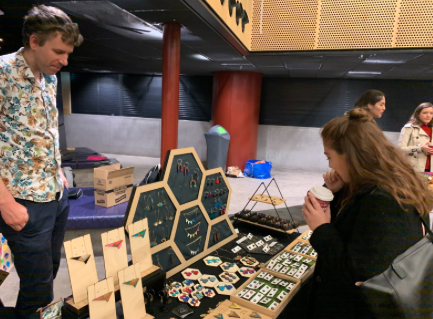
Locate an element on the screen. This screenshot has height=319, width=433. grey trash can is located at coordinates (215, 161).